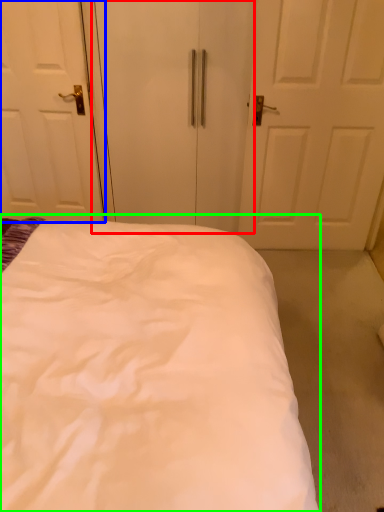
Question: Which object is the closest to the screen door (highlighted by a red box)? Choose among these: door (highlighted by a blue box) or bed (highlighted by a green box).

Choices:
 (A) door
 (B) bed

Answer: (A)